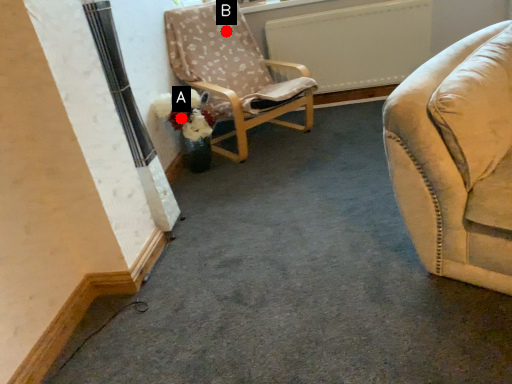
Question: Two points are circled on the image, labeled by A and B beside each circle. Which point is closer to the camera?

Choices:
 (A) A is closer
 (B) B is closer

Answer: (A)